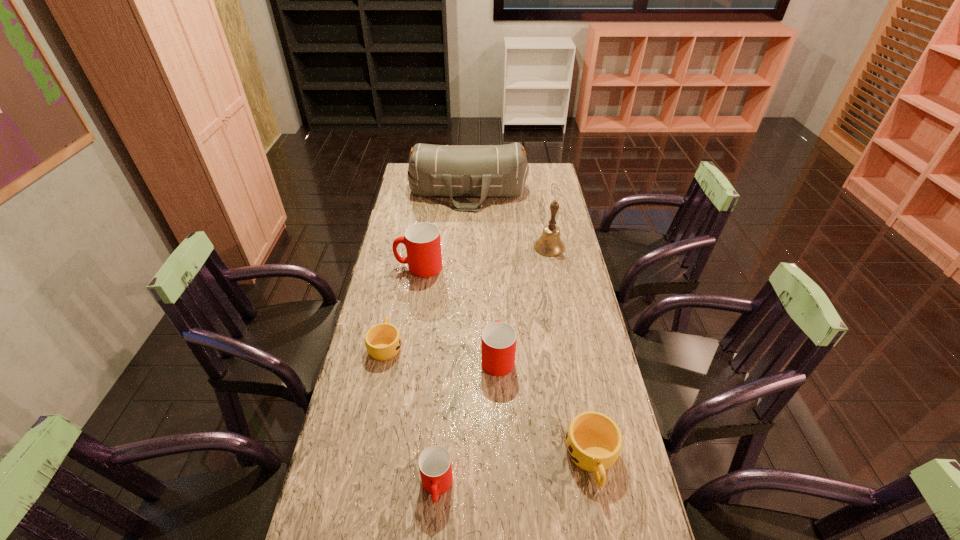
I want to click on the farther beige cup, so click(x=383, y=341).

Identify the location of the left beige cup. The height and width of the screenshot is (540, 960). (383, 341).

The width and height of the screenshot is (960, 540). Find the location of `free space located on the front of the duffel bag`. free space located on the front of the duffel bag is located at coordinates (467, 239).

Where is `free space located 0.290m on the left of the bell`? The width and height of the screenshot is (960, 540). free space located 0.290m on the left of the bell is located at coordinates (462, 247).

At what (x,y) coordinates should I click in order to perform the action: click on free space located on the side of the leftmost red cup with the handle. Please return your answer as a coordinate pair (x, y). This screenshot has width=960, height=540. Looking at the image, I should click on (380, 267).

The width and height of the screenshot is (960, 540). In order to click on free space located 0.160m on the side of the second nearest red cup with the handle in this screenshot , I will do `click(495, 304)`.

The height and width of the screenshot is (540, 960). Find the location of `vacant space located on the side of the second nearest red cup with the handle`. vacant space located on the side of the second nearest red cup with the handle is located at coordinates (495, 302).

You are a GUI agent. You are given a task and a screenshot of the screen. Output one action in this format:
    pyautogui.click(x=<x>, y=<y>)
    Task: Click on the vacant space located 0.400m on the side of the second nearest red cup with the handle
    This screenshot has width=960, height=540.
    Given the screenshot: What is the action you would take?
    pyautogui.click(x=494, y=260)

The width and height of the screenshot is (960, 540). What are the coordinates of `vacant space located 0.060m on the side of the third cup from left to right with the handle` in the screenshot? It's located at (433, 537).

This screenshot has height=540, width=960. In order to click on vacant position located 0.290m on the back of the fourth tallest cup in this screenshot , I will do `click(569, 343)`.